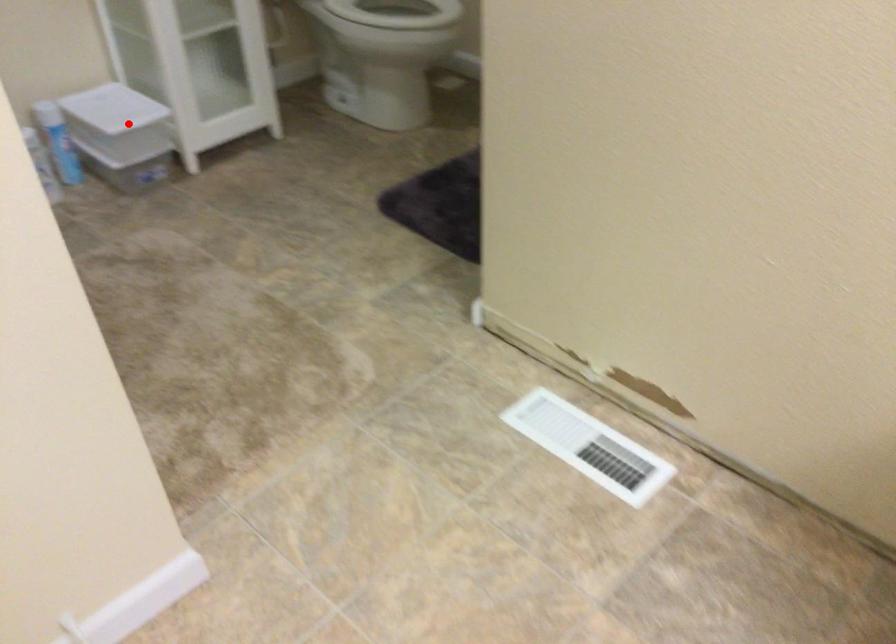
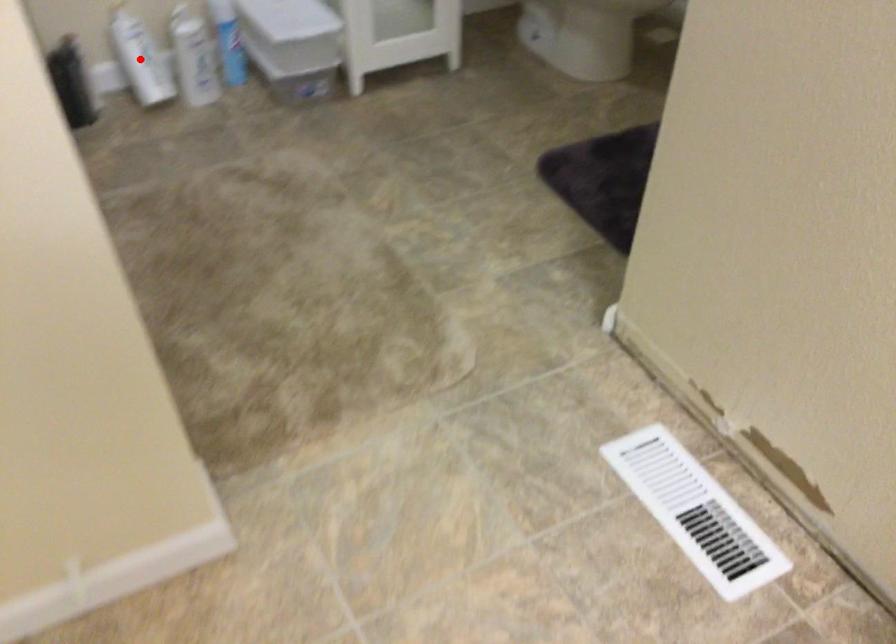
I am providing you with two images of the same scene from different viewpoints. A red point is marked on the first image and another point is marked on the second image. Is the marked point in image1 the same physical position as the marked point in image2?

No